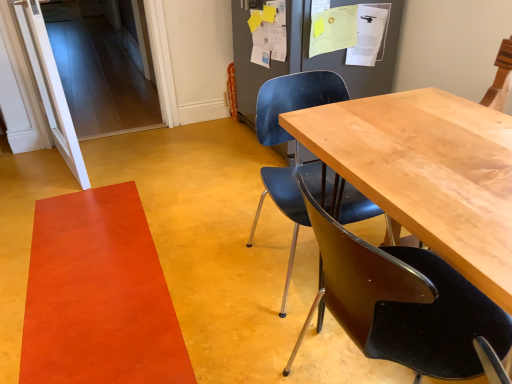
Find the location of a particular element. vacant region above orange matte rug at lower left (from a real-world perspective) is located at coordinates [98, 273].